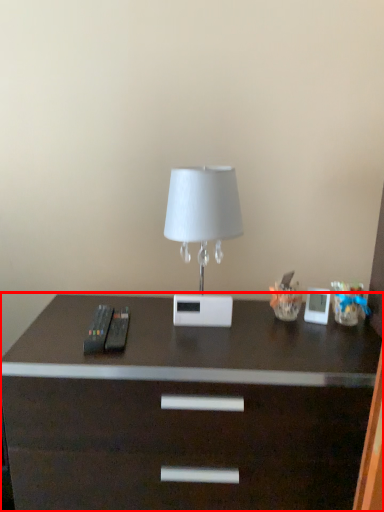
Question: From the image, what is the correct spatial relationship of desk (annotated by the red box) in relation to lamp?

Choices:
 (A) right
 (B) left

Answer: (B)